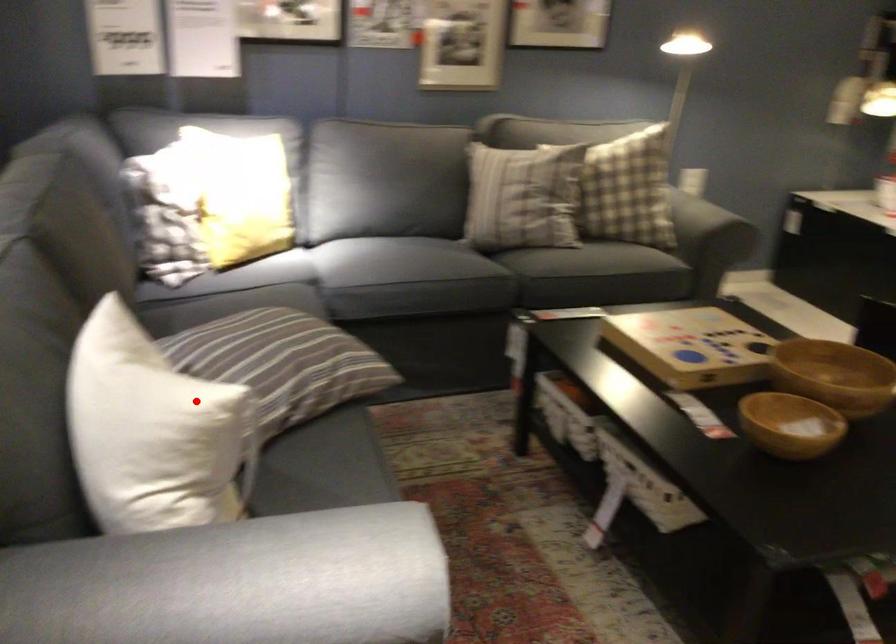
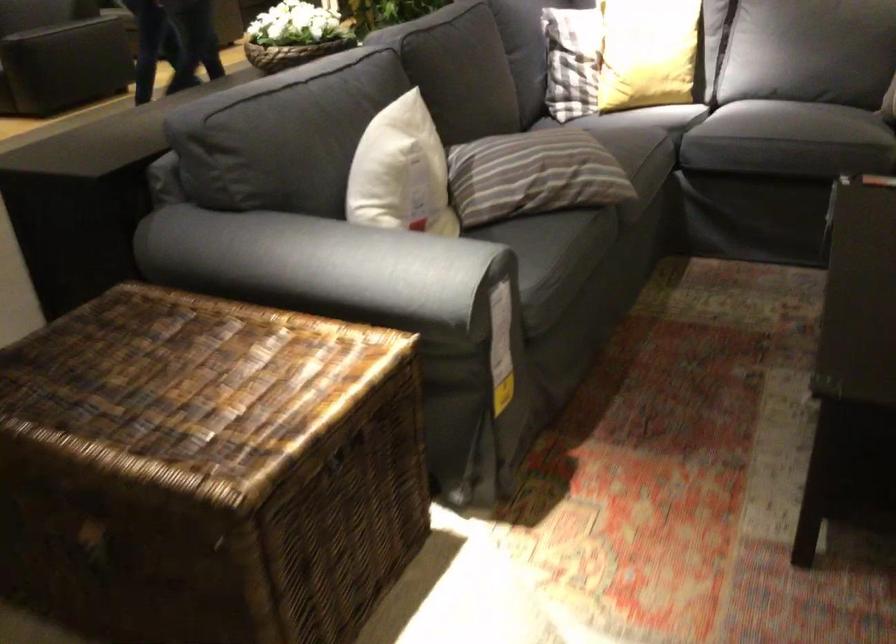
Question: I am providing you with two images of the same scene from different viewpoints. A red point is shown in image1. For the corresponding object point in image2, is it positioned nearer or farther from the camera?

Choices:
 (A) Nearer
 (B) Farther

Answer: (B)